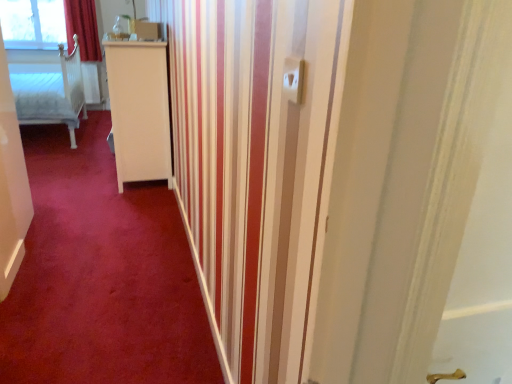
Question: Can you confirm if red velvet curtain at upper left is thinner than transparent glass window at upper left?

Choices:
 (A) yes
 (B) no

Answer: (B)

Question: Is transparent glass window at upper left located within red velvet curtain at upper left?

Choices:
 (A) no
 (B) yes

Answer: (A)

Question: Is red velvet curtain at upper left at the left side of transparent glass window at upper left?

Choices:
 (A) no
 (B) yes

Answer: (A)

Question: Are red velvet curtain at upper left and transparent glass window at upper left beside each other?

Choices:
 (A) no
 (B) yes

Answer: (A)

Question: Is red velvet curtain at upper left positioned with its back to transparent glass window at upper left?

Choices:
 (A) yes
 (B) no

Answer: (B)

Question: Considering the relative sizes of red velvet curtain at upper left and transparent glass window at upper left in the image provided, is red velvet curtain at upper left wider than transparent glass window at upper left?

Choices:
 (A) yes
 (B) no

Answer: (A)

Question: Considering the relative sizes of white wooden bed at left and red carpet at center in the image provided, is white wooden bed at left smaller than red carpet at center?

Choices:
 (A) no
 (B) yes

Answer: (A)

Question: From a real-world perspective, does white wooden bed at left stand above red carpet at center?

Choices:
 (A) yes
 (B) no

Answer: (A)

Question: Is white wooden bed at left far from red carpet at center?

Choices:
 (A) yes
 (B) no

Answer: (A)

Question: Can you confirm if white wooden bed at left is positioned to the left of red carpet at center?

Choices:
 (A) yes
 (B) no

Answer: (A)

Question: Is white wooden bed at left thinner than red carpet at center?

Choices:
 (A) no
 (B) yes

Answer: (B)

Question: Does white wooden bed at left have a greater height compared to red carpet at center?

Choices:
 (A) no
 (B) yes

Answer: (B)

Question: Is white plastic electric outlet at upper center positioned in front of white wooden bed at left?

Choices:
 (A) no
 (B) yes

Answer: (B)